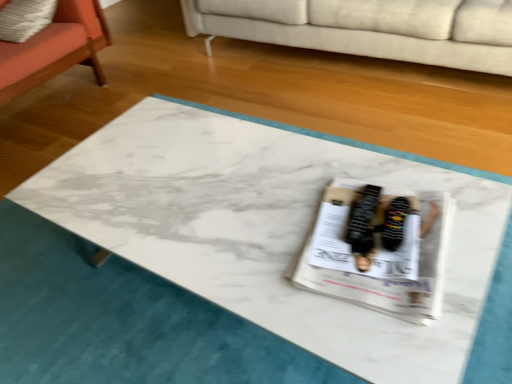
Locate an element on the screen. This screenshot has width=512, height=384. free point behind white glossy magazine at center is located at coordinates (314, 167).